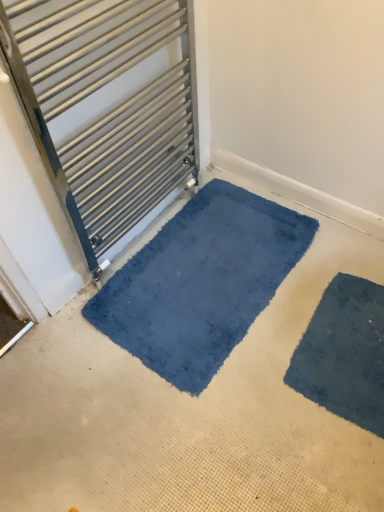
Question: Is dark blue plush bath mat at lower right aimed at blue soft carpet at center?

Choices:
 (A) no
 (B) yes

Answer: (B)

Question: Is dark blue plush bath mat at lower right positioned beyond the bounds of blue soft carpet at center?

Choices:
 (A) yes
 (B) no

Answer: (B)

Question: Are dark blue plush bath mat at lower right and blue soft carpet at center located far from each other?

Choices:
 (A) no
 (B) yes

Answer: (A)

Question: From the image's perspective, is dark blue plush bath mat at lower right located above blue soft carpet at center?

Choices:
 (A) yes
 (B) no

Answer: (A)

Question: From a real-world perspective, does dark blue plush bath mat at lower right stand above blue soft carpet at center?

Choices:
 (A) yes
 (B) no

Answer: (A)

Question: Considering the positions of blue plush mat at lower center and satin silver towel rail at upper left in the image, is blue plush mat at lower center wider or thinner than satin silver towel rail at upper left?

Choices:
 (A) thin
 (B) wide

Answer: (B)

Question: Is point (228, 183) closer or farther from the camera than point (26, 100)?

Choices:
 (A) farther
 (B) closer

Answer: (A)

Question: Is blue plush mat at lower center spatially inside satin silver towel rail at upper left, or outside of it?

Choices:
 (A) outside
 (B) inside

Answer: (A)

Question: Is blue plush mat at lower center taller or shorter than satin silver towel rail at upper left?

Choices:
 (A) short
 (B) tall

Answer: (A)

Question: From the image's perspective, relative to blue plush mat at lower center, is blue soft carpet at center above or below?

Choices:
 (A) below
 (B) above

Answer: (A)

Question: Considering the positions of point (261, 505) and point (185, 368), is point (261, 505) closer or farther from the camera than point (185, 368)?

Choices:
 (A) closer
 (B) farther

Answer: (A)

Question: Considering the relative positions of blue soft carpet at center and blue plush mat at lower center in the image provided, is blue soft carpet at center to the left or to the right of blue plush mat at lower center?

Choices:
 (A) right
 (B) left

Answer: (A)

Question: In the image, is blue soft carpet at center positioned in front of or behind blue plush mat at lower center?

Choices:
 (A) front
 (B) behind

Answer: (A)

Question: From the image's perspective, is satin silver towel rail at upper left above or below blue plush mat at lower center?

Choices:
 (A) above
 (B) below

Answer: (A)

Question: Visually, is satin silver towel rail at upper left positioned to the left or to the right of blue plush mat at lower center?

Choices:
 (A) right
 (B) left

Answer: (B)